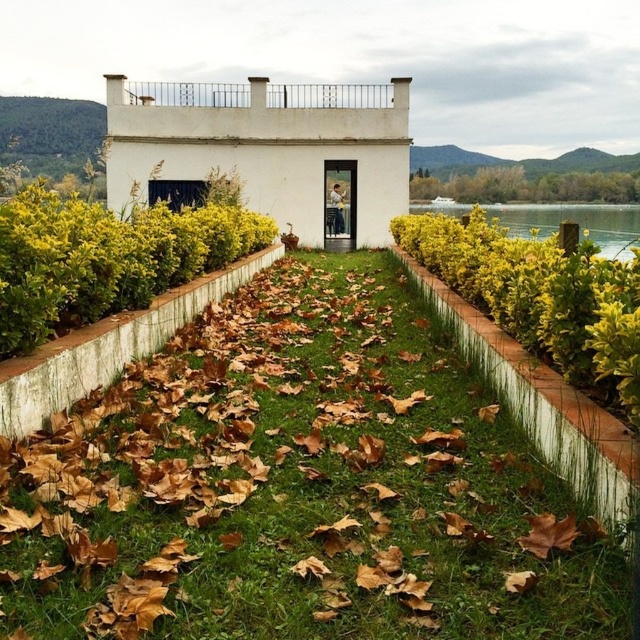
From the picture: Which is more to the right, green grass at center or green water at right?

From the viewer's perspective, green water at right appears more on the right side.

Does green grass at center appear under green water at right?

Correct, green grass at center is located below green water at right.

Is point (413, 440) farther from viewer compared to point (637, 216)?

No.

The image size is (640, 640). What are the coordinates of `green grass at center` in the screenshot? It's located at (300, 486).